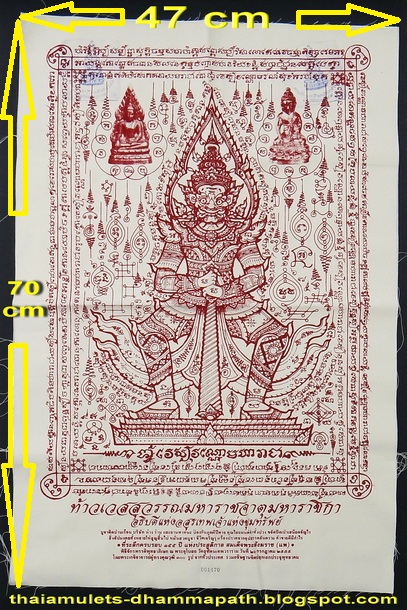
I want to click on statue, so click(x=294, y=130), click(x=212, y=241), click(x=142, y=137).